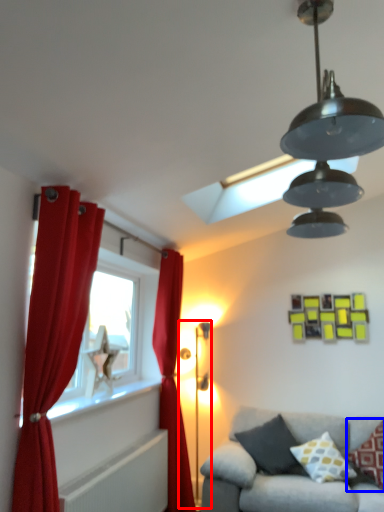
Question: Which object appears farthest to the camera in this image, table lamp (highlighted by a red box) or pillow (highlighted by a blue box)?

Choices:
 (A) table lamp
 (B) pillow

Answer: (A)